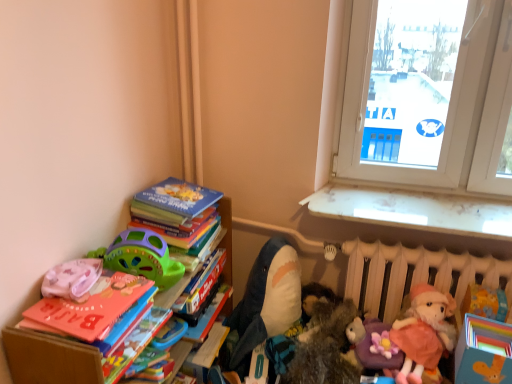
Question: Is the position of hardcover book at center, which is counted as the second book, starting from the bottom, more distant than that of white plastic window at upper right?

Choices:
 (A) yes
 (B) no

Answer: (B)

Question: From the image's perspective, is hardcover book at center, which is counted as the second book, starting from the bottom, on white plastic window at upper right?

Choices:
 (A) no
 (B) yes

Answer: (A)

Question: Is the depth of hardcover book at center, which is counted as the second book, starting from the bottom, less than that of white plastic window at upper right?

Choices:
 (A) yes
 (B) no

Answer: (A)

Question: Considering the relative sizes of hardcover book at center, the 2th book viewed from the top, and white plastic window at upper right in the image provided, is hardcover book at center, the 2th book viewed from the top, wider than white plastic window at upper right?

Choices:
 (A) no
 (B) yes

Answer: (A)

Question: Is hardcover book at center, which is counted as the second book, starting from the bottom, taller than white plastic window at upper right?

Choices:
 (A) yes
 (B) no

Answer: (B)

Question: From a real-world perspective, is hardcover book at center, which is counted as the second book, starting from the bottom, positioned over white plastic window at upper right based on gravity?

Choices:
 (A) yes
 (B) no

Answer: (B)

Question: Is white glossy window sill at upper right to the right of purple plush toy at lower right, the 2th toy viewed from the right, from the viewer's perspective?

Choices:
 (A) no
 (B) yes

Answer: (B)

Question: Considering the relative sizes of white glossy window sill at upper right and purple plush toy at lower right, the 2th toy viewed from the right, in the image provided, is white glossy window sill at upper right shorter than purple plush toy at lower right, the 2th toy viewed from the right,?

Choices:
 (A) no
 (B) yes

Answer: (B)

Question: Can you see white glossy window sill at upper right touching purple plush toy at lower right, acting as the 5th toy starting from the left?

Choices:
 (A) yes
 (B) no

Answer: (B)

Question: Is white glossy window sill at upper right located outside purple plush toy at lower right, the 2th toy viewed from the right?

Choices:
 (A) yes
 (B) no

Answer: (A)

Question: Is white glossy window sill at upper right wider than purple plush toy at lower right, the 2th toy viewed from the right?

Choices:
 (A) yes
 (B) no

Answer: (A)

Question: Is white glossy window sill at upper right positioned behind purple plush toy at lower right, acting as the 5th toy starting from the left?

Choices:
 (A) no
 (B) yes

Answer: (B)

Question: From the image's perspective, is pink fabric pillow at left, which is the 1th toy in left-to-right order, beneath soft plush shark at center, which is counted as the 3th toy, starting from the left?

Choices:
 (A) yes
 (B) no

Answer: (B)